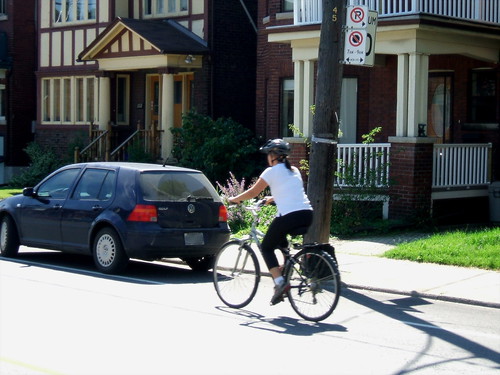
Locate an element on the screen. The image size is (500, 375). round pillars is located at coordinates (107, 92), (170, 99).